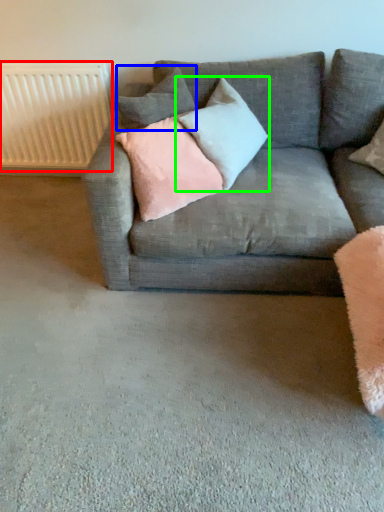
Question: Estimate the real-world distances between objects in this image. Which object is farther from radiator (highlighted by a red box), pillow (highlighted by a blue box) or pillow (highlighted by a green box)?

Choices:
 (A) pillow
 (B) pillow

Answer: (B)